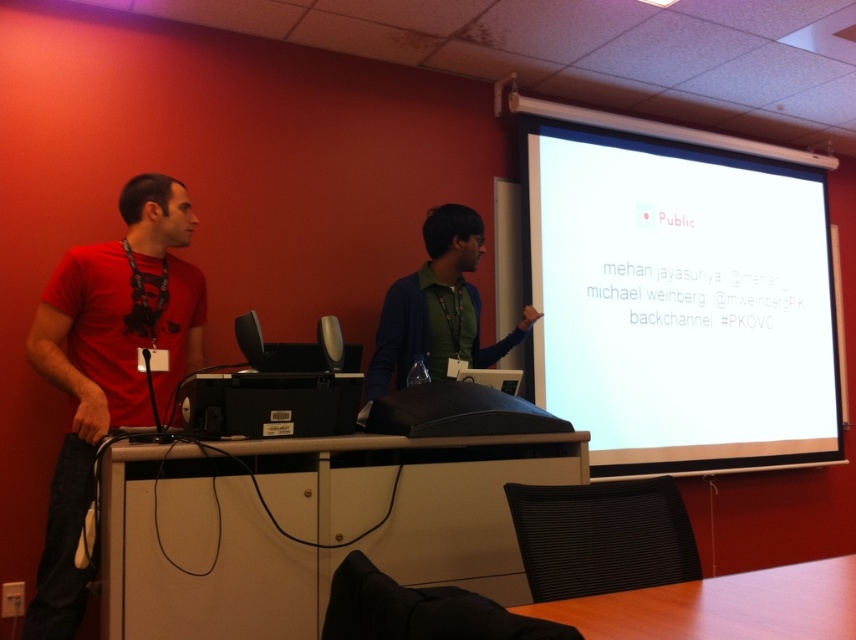
Question: Based on their relative distances, which object is nearer to the white glossy projection screen at upper right?

Choices:
 (A) green matte shirt at center
 (B) white glossy table at lower center
 (C) wooden table at lower center
 (D) black matte projector at center

Answer: (A)

Question: Does matte red t-shirt at left appear on the left side of wooden table at lower center?

Choices:
 (A) no
 (B) yes

Answer: (B)

Question: Is green matte shirt at center below black matte projector at center?

Choices:
 (A) yes
 (B) no

Answer: (B)

Question: Is green matte shirt at center closer to the viewer compared to black matte projector at center?

Choices:
 (A) no
 (B) yes

Answer: (A)

Question: Which of these objects is positioned farthest from the black matte projector at center?

Choices:
 (A) white glossy projection screen at upper right
 (B) matte red t-shirt at left

Answer: (A)

Question: Which point is closer to the camera?

Choices:
 (A) (515, 433)
 (B) (535, 317)
 (C) (740, 321)

Answer: (A)